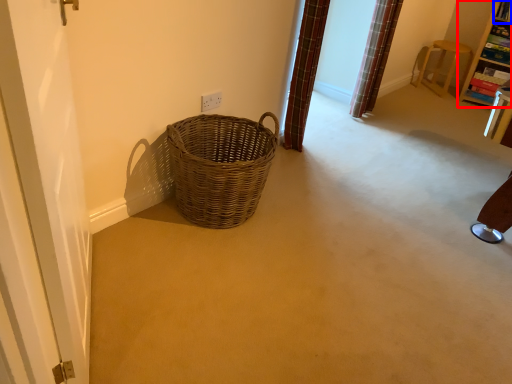
Question: Which point is closer to the camera, furniture (highlighted by a red box) or shelf (highlighted by a blue box)?

Choices:
 (A) furniture
 (B) shelf

Answer: (A)